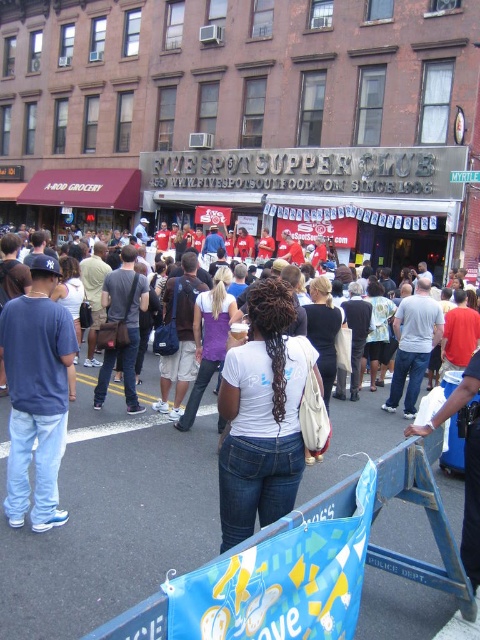
Question: Which of the following is the farthest from the observer?

Choices:
 (A) matte blue jeans at left
 (B) white matte shirt at center

Answer: (A)

Question: Does white matte shirt at center appear under matte blue jeans at left?

Choices:
 (A) yes
 (B) no

Answer: (A)

Question: Among these points, which one is farthest from the camera?

Choices:
 (A) (7, 474)
 (B) (224, 468)

Answer: (A)

Question: Can you confirm if white matte shirt at center is positioned to the left of matte blue jeans at left?

Choices:
 (A) yes
 (B) no

Answer: (B)

Question: Can you confirm if white matte shirt at center is positioned below matte blue jeans at left?

Choices:
 (A) yes
 (B) no

Answer: (A)